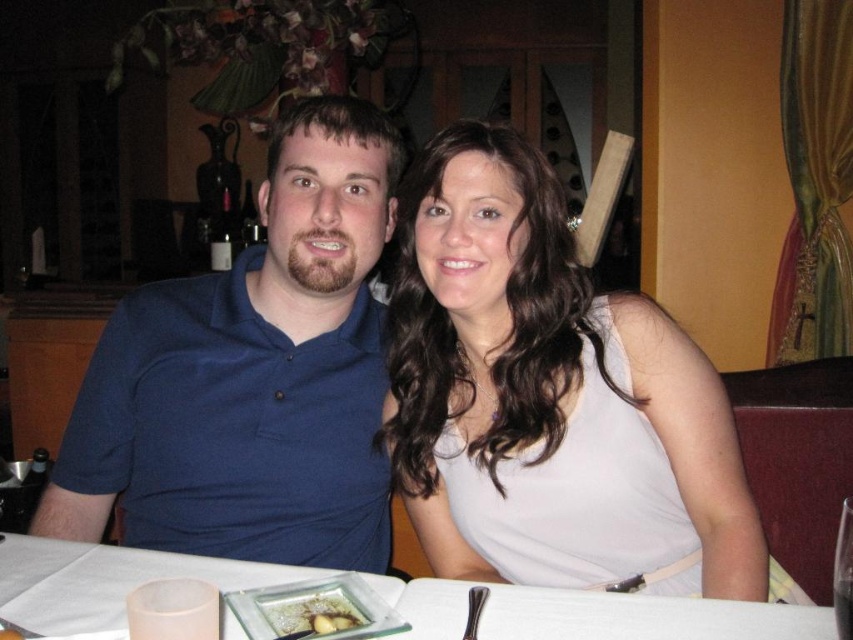
You are a waiter in a restaurant and need to place a new drink order for the couple. The drink should be placed on the table between the matte white dress at center and the slightly browned bread at center. Where exactly should you place the drink?

Place the drink between the matte white dress at center and the slightly browned bread at center. Since the matte white dress at center is to the right of the slightly browned bread at center, the drink should be placed to the left of the matte white dress at center and to the right of the slightly browned bread at center.

You are a photographer adjusting the lighting for a portrait. You notice the blue cotton shirt at upper left and the white paper napkin at center on the table. Which object should you focus on first if you want to ensure both are well lit, considering their sizes?

The blue cotton shirt at upper left should be focused on first because it is larger in size than the white paper napkin at center, making it more prominent in the composition.